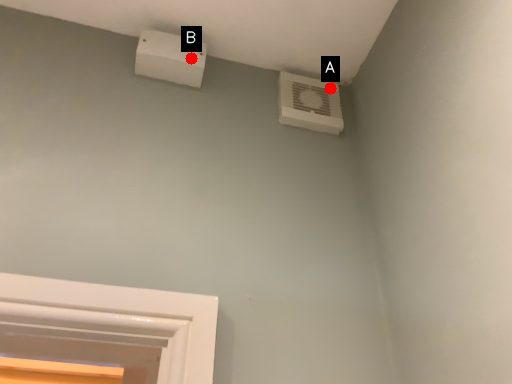
Question: Two points are circled on the image, labeled by A and B beside each circle. Which point is farther to the camera?

Choices:
 (A) A is further
 (B) B is further

Answer: (A)